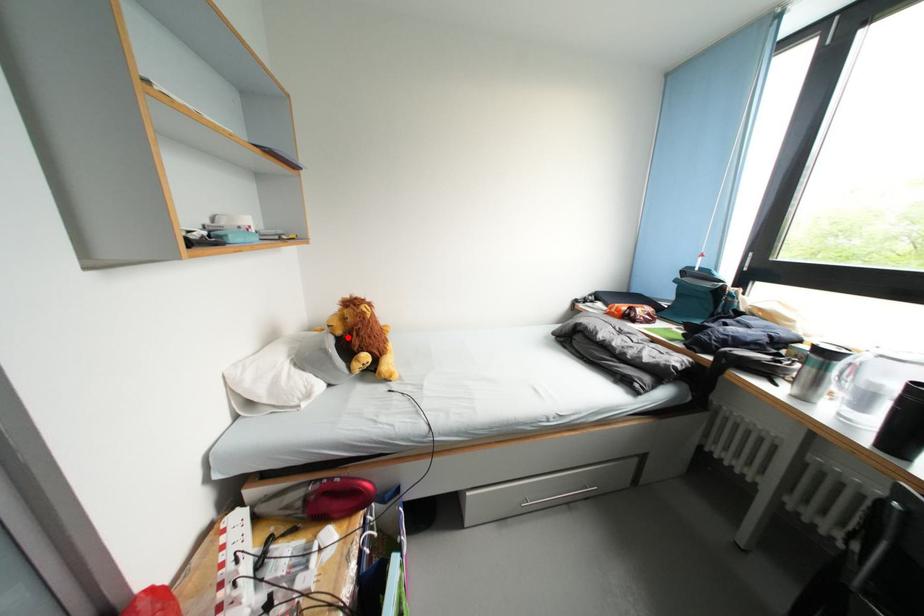
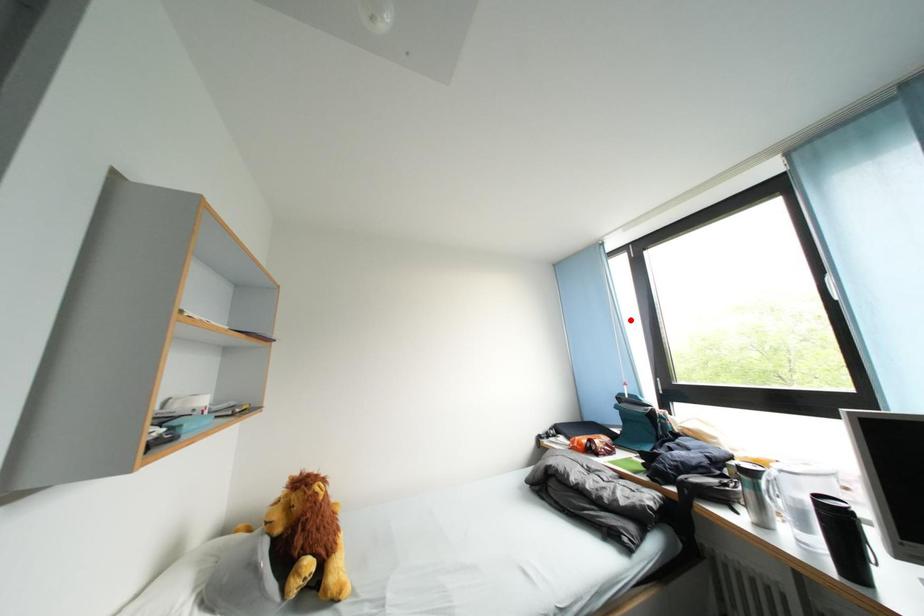
Looking at this image, I am providing you with two images of the same scene from different viewpoints. A red point is marked on the first image and another point is marked on the second image. Is the red point in image1 aligned with the point shown in image2?

No